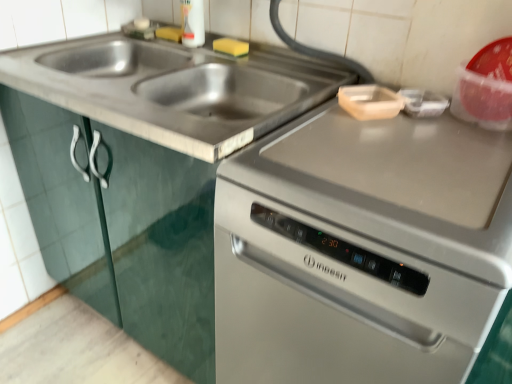
Locate an element on the screen. The height and width of the screenshot is (384, 512). free location to the right of wooden cutting board at upper right is located at coordinates (455, 129).